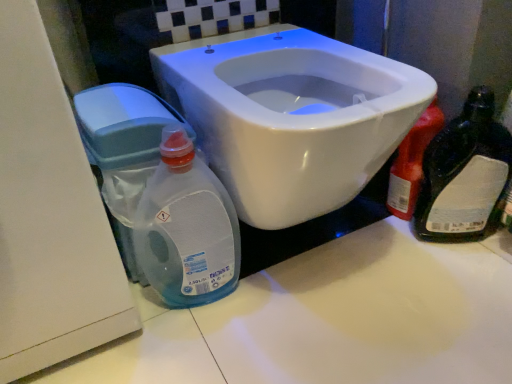
Question: From the image's perspective, is white glossy toilet at center beneath translucent plastic bottle at right?

Choices:
 (A) no
 (B) yes

Answer: (A)

Question: Is white glossy toilet at center not inside translucent plastic bottle at right?

Choices:
 (A) yes
 (B) no

Answer: (A)

Question: Is white glossy toilet at center positioned far away from translucent plastic bottle at right?

Choices:
 (A) no
 (B) yes

Answer: (A)

Question: Considering the relative sizes of white glossy toilet at center and translucent plastic bottle at right in the image provided, is white glossy toilet at center wider than translucent plastic bottle at right?

Choices:
 (A) yes
 (B) no

Answer: (A)

Question: From the image's perspective, is white glossy toilet at center on top of translucent plastic bottle at right?

Choices:
 (A) yes
 (B) no

Answer: (A)

Question: From the image's perspective, is white glossy toilet at center located above or below transparent plastic bottle at lower left?

Choices:
 (A) below
 (B) above

Answer: (B)

Question: Is white glossy toilet at center taller or shorter than transparent plastic bottle at lower left?

Choices:
 (A) tall
 (B) short

Answer: (A)

Question: In terms of size, does white glossy toilet at center appear bigger or smaller than transparent plastic bottle at lower left?

Choices:
 (A) small
 (B) big

Answer: (B)

Question: From a real-world perspective, relative to transparent plastic bottle at lower left, is white glossy toilet at center vertically above or below?

Choices:
 (A) above
 (B) below

Answer: (A)

Question: From the image's perspective, is translucent plastic bottle at right located above or below transparent plastic water tank at lower left?

Choices:
 (A) below
 (B) above

Answer: (B)

Question: Considering the positions of translucent plastic bottle at right and transparent plastic water tank at lower left in the image, is translucent plastic bottle at right bigger or smaller than transparent plastic water tank at lower left?

Choices:
 (A) small
 (B) big

Answer: (A)

Question: In the image, is translucent plastic bottle at right positioned in front of or behind transparent plastic water tank at lower left?

Choices:
 (A) front
 (B) behind

Answer: (B)

Question: Is point (400, 182) closer or farther from the camera than point (104, 115)?

Choices:
 (A) farther
 (B) closer

Answer: (A)

Question: Looking at the image, does white glossy toilet at center seem bigger or smaller compared to translucent plastic bottle at right?

Choices:
 (A) small
 (B) big

Answer: (B)

Question: Considering the positions of white glossy toilet at center and translucent plastic bottle at right in the image, is white glossy toilet at center taller or shorter than translucent plastic bottle at right?

Choices:
 (A) tall
 (B) short

Answer: (A)